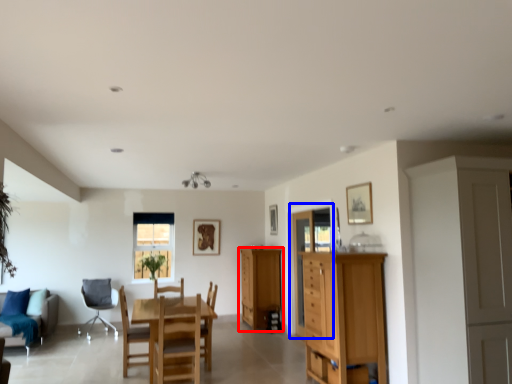
Question: Which object appears farthest to the camera in this image, cabinetry (highlighted by a red box) or glass door (highlighted by a blue box)?

Choices:
 (A) cabinetry
 (B) glass door

Answer: (A)